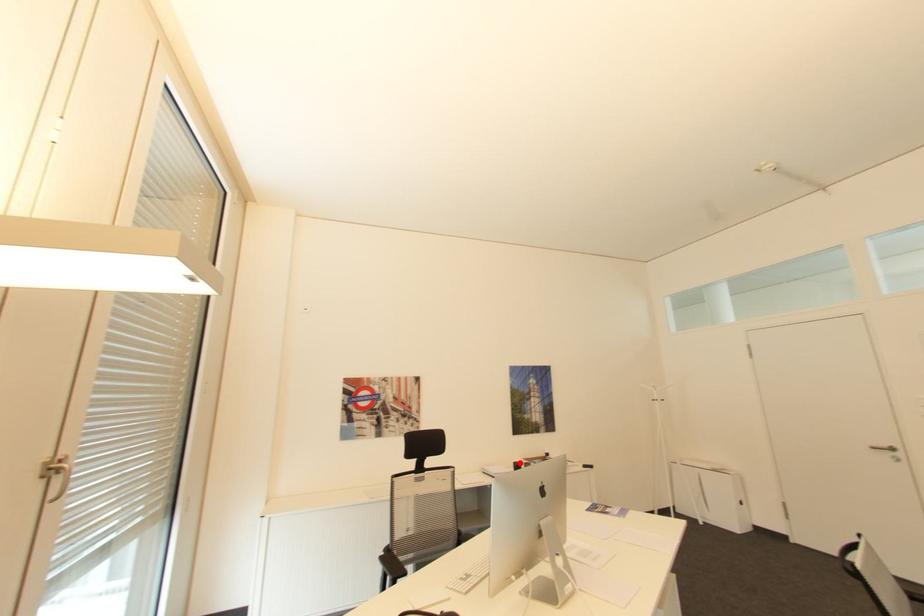
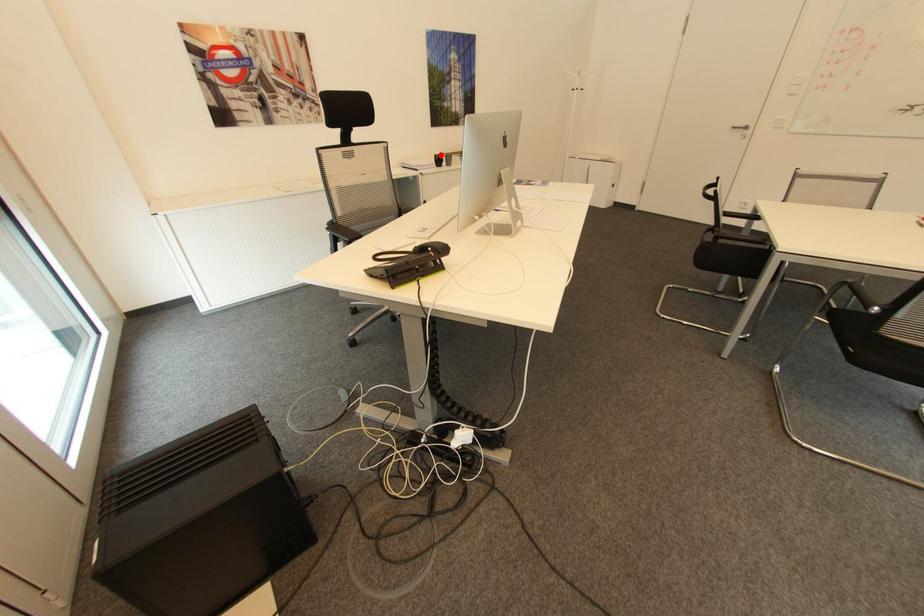
I am providing you with two images of the same scene from different viewpoints. A red point is marked on the first image and another point is marked on the second image. Are the points marked in image1 and image2 representing the same 3D position?

Yes